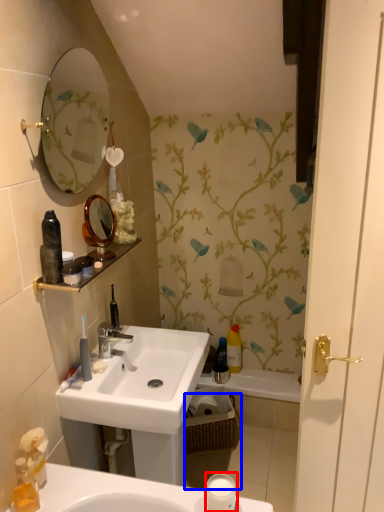
Question: Which point is closer to the camera, candle holder (highlighted by a red box) or basket (highlighted by a blue box)?

Choices:
 (A) candle holder
 (B) basket

Answer: (A)